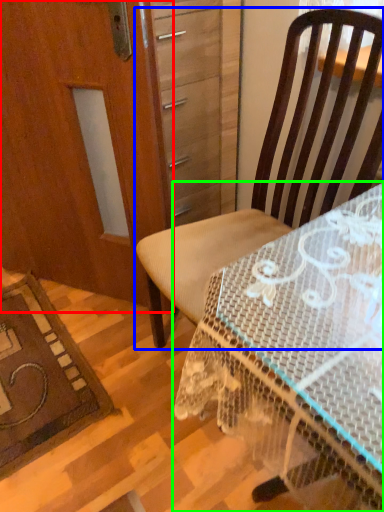
Question: Which object is the closest to the screen door (highlighted by a red box)? Choose among these: chair (highlighted by a blue box) or desk (highlighted by a green box).

Choices:
 (A) chair
 (B) desk

Answer: (A)